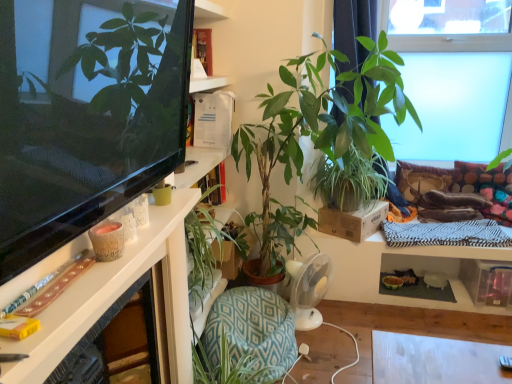
Identify the location of empty space that is ontop of white glossy desk at left (from a real-world perspective). The height and width of the screenshot is (384, 512). (96, 260).